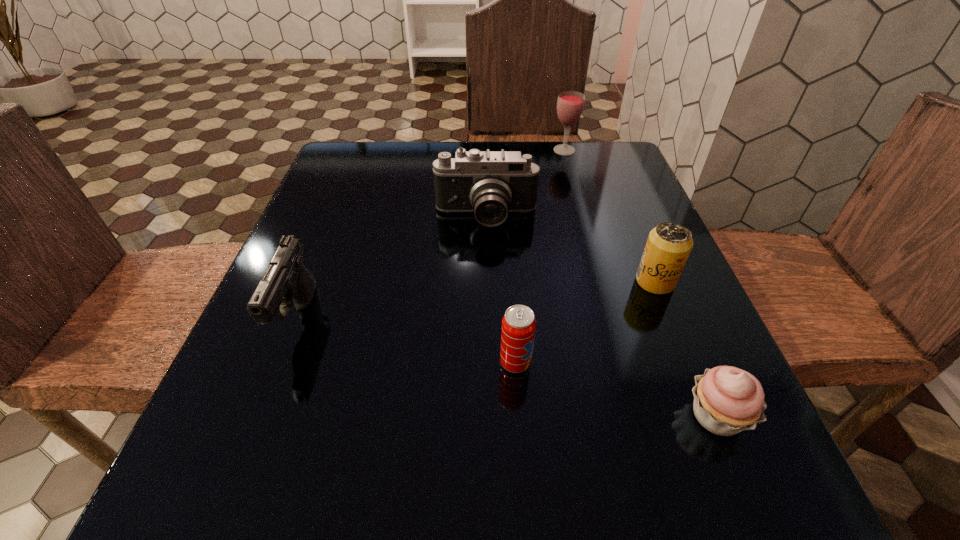
Find the location of `wineglass`. wineglass is located at coordinates (570, 104).

Locate an element on the screen. the farthest object is located at coordinates (570, 104).

Locate an element on the screen. camera is located at coordinates (490, 184).

Image resolution: width=960 pixels, height=540 pixels. I want to click on the leftmost object, so click(x=287, y=279).

Where is `beer can`? This screenshot has height=540, width=960. beer can is located at coordinates (668, 246).

Where is `soda can`? This screenshot has height=540, width=960. soda can is located at coordinates (518, 328).

The height and width of the screenshot is (540, 960). Find the location of `the nearest object`. the nearest object is located at coordinates (727, 400).

Where is `vacant position located on the front of the wineglass`? The image size is (960, 540). vacant position located on the front of the wineglass is located at coordinates (578, 199).

Locate an element on the screen. Image resolution: width=960 pixels, height=540 pixels. vacant region located on the front-facing side of the camera is located at coordinates (489, 391).

Locate an element on the screen. This screenshot has width=960, height=540. vacant point located at the barrel of the pistol is located at coordinates (x=253, y=434).